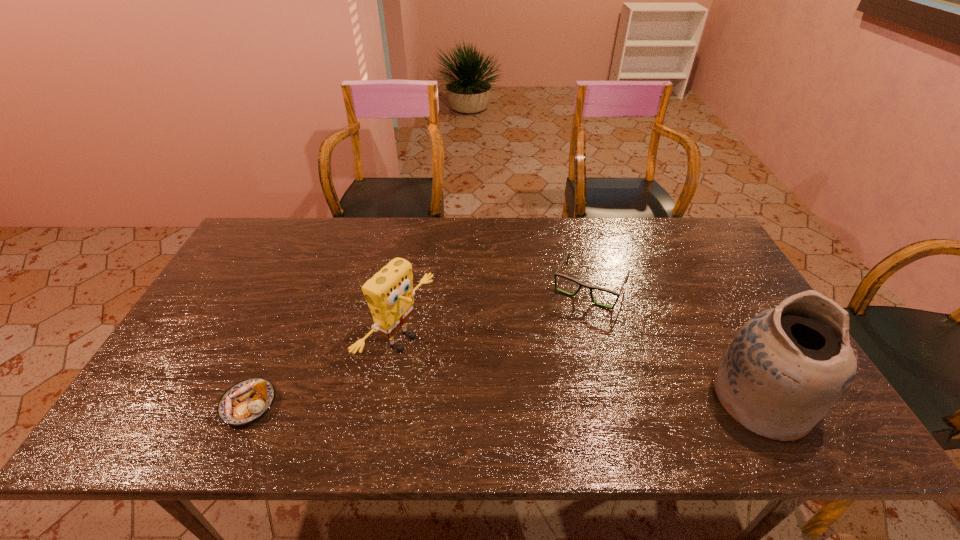
You are a GUI agent. You are given a task and a screenshot of the screen. Output one action in this format:
    pyautogui.click(x=<x>, y=<y>)
    Task: Click on the leftmost object
    
    Given the screenshot: What is the action you would take?
    pyautogui.click(x=245, y=402)

You are a GUI agent. You are given a task and a screenshot of the screen. Output one action in this format:
    pyautogui.click(x=<x>, y=<y>)
    Task: Click on the pastry
    This screenshot has height=540, width=960.
    Given the screenshot: What is the action you would take?
    (245, 402)

Locate an element on the screen. This screenshot has height=540, width=960. pottery is located at coordinates (785, 369).

Locate an element on the screen. The image size is (960, 540). the tallest object is located at coordinates (785, 369).

You are a GUI agent. You are given a task and a screenshot of the screen. Output one action in this format:
    pyautogui.click(x=<x>, y=<y>)
    Task: Click on the second shortest object
    
    Given the screenshot: What is the action you would take?
    pyautogui.click(x=581, y=284)

At what (x,y) coordinates should I click in order to perform the action: click on the third object from left to right. Please return your answer as a coordinate pair (x, y). The image size is (960, 540). Looking at the image, I should click on (581, 284).

The height and width of the screenshot is (540, 960). In order to click on sponge in this screenshot , I will do `click(389, 293)`.

Identify the location of the third shortest object. (389, 293).

This screenshot has height=540, width=960. I want to click on free region located on the left of the pastry, so click(x=179, y=404).

Locate an element on the screen. The image size is (960, 540). free location located 0.320m on the back of the tallest object is located at coordinates (695, 277).